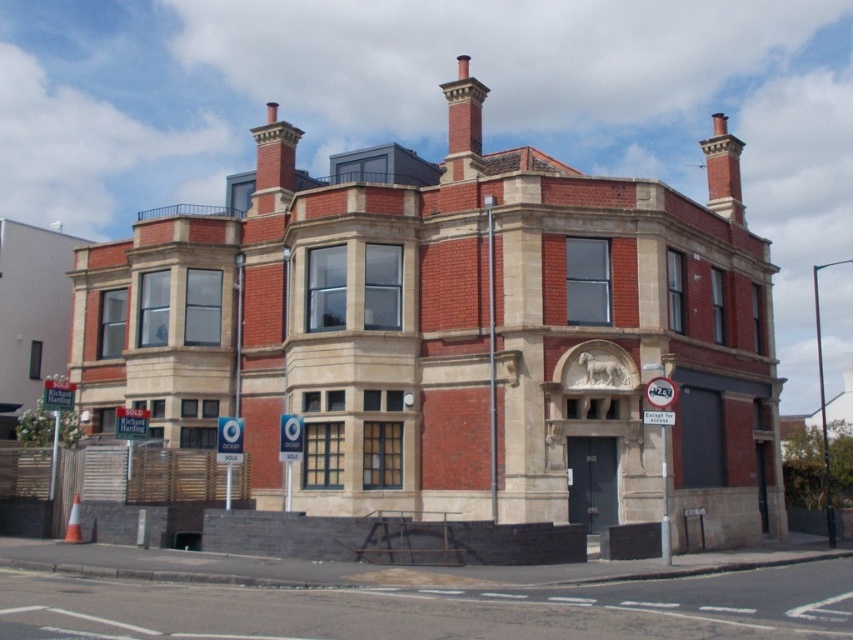
Can you confirm if red brick chimney at upper center is positioned to the left of asphalt at lower center?

Yes, red brick chimney at upper center is to the left of asphalt at lower center.

Does point (764, 257) come farther from viewer compared to point (717, 620)?

Yes, it is behind point (717, 620).

You are a GUI agent. You are given a task and a screenshot of the screen. Output one action in this format:
    pyautogui.click(x=<x>, y=<y>)
    Task: Click on the red brick chimney at upper center
    This screenshot has width=853, height=640.
    Given the screenshot: What is the action you would take?
    pyautogui.click(x=453, y=333)